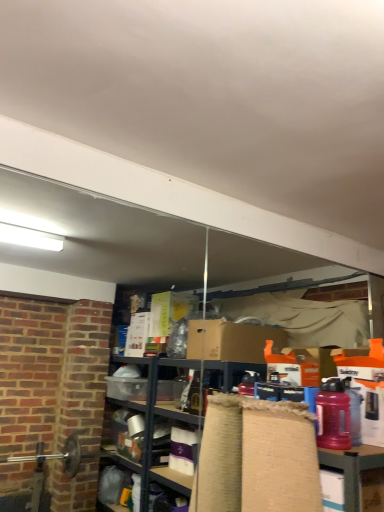
Describe the element at coordinates (333, 415) in the screenshot. I see `translucent pink water bottle at right` at that location.

The height and width of the screenshot is (512, 384). In order to click on translucent pink water bottle at right in this screenshot , I will do `click(333, 415)`.

Identify the location of translucent pink water bottle at right. (333, 415).